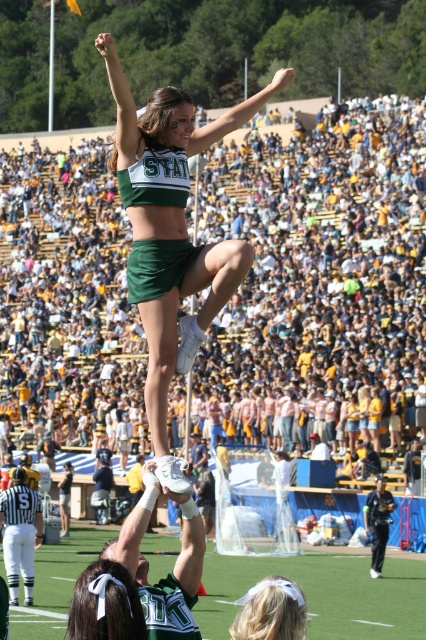
Question: Which object appears farthest from the camera in this image?

Choices:
 (A) green matte uniform at center
 (B) yellow and white crowd at upper center
 (C) green turf football field at center

Answer: (B)

Question: Can you confirm if green matte uniform at center is smaller than green turf football field at center?

Choices:
 (A) yes
 (B) no

Answer: (B)

Question: Which point is farther to the camera?

Choices:
 (A) (271, 593)
 (B) (334, 605)
 (C) (198, 285)
 (D) (419, 360)

Answer: (D)

Question: Does green matte uniform at center appear on the left side of white satin headband at lower center?

Choices:
 (A) yes
 (B) no

Answer: (A)

Question: Which of the following is the farthest from the observer?

Choices:
 (A) (233, 118)
 (B) (334, 620)

Answer: (B)

Question: Does green turf football field at center have a lesser width compared to white satin headband at lower center?

Choices:
 (A) no
 (B) yes

Answer: (A)